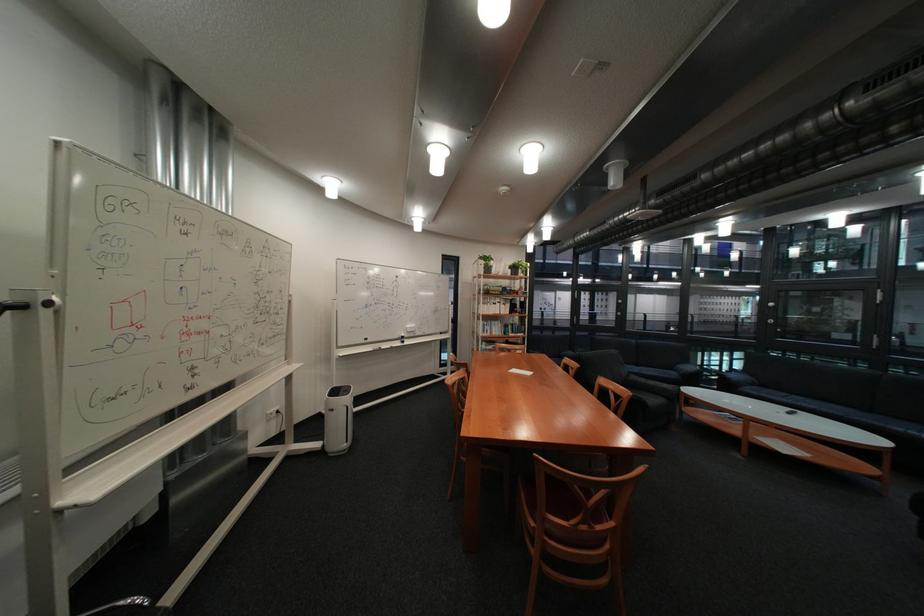
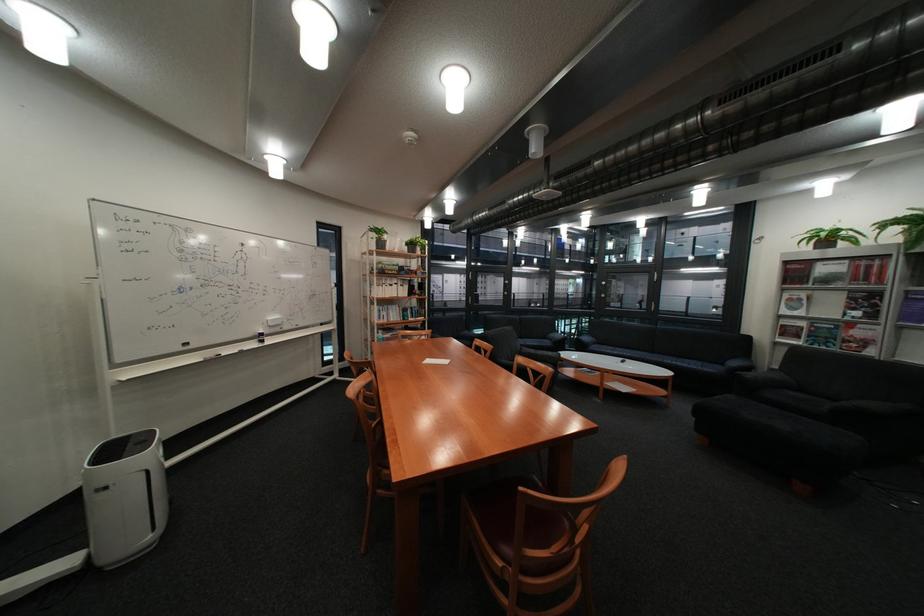
Find the pixel in the second image that matches (551,523) in the first image.

(526, 567)